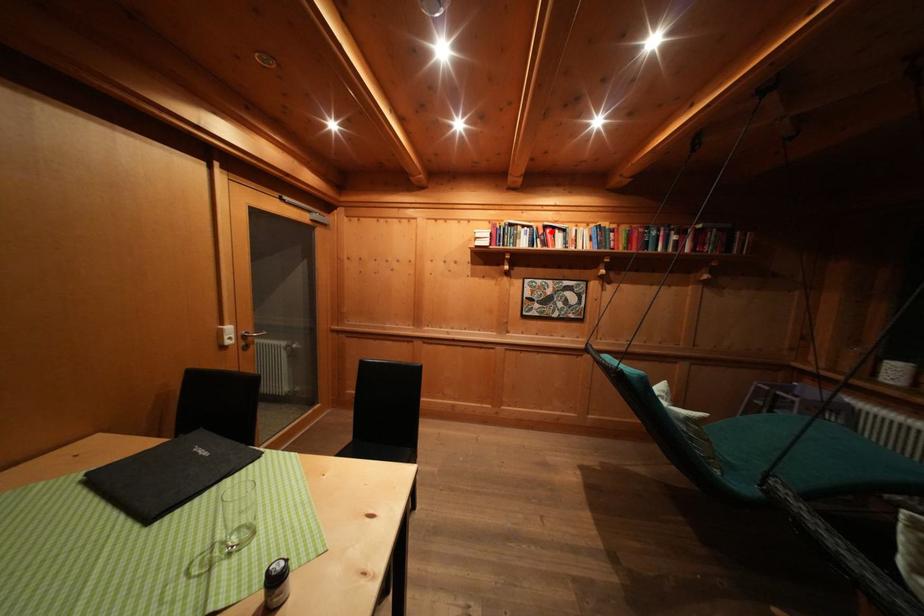
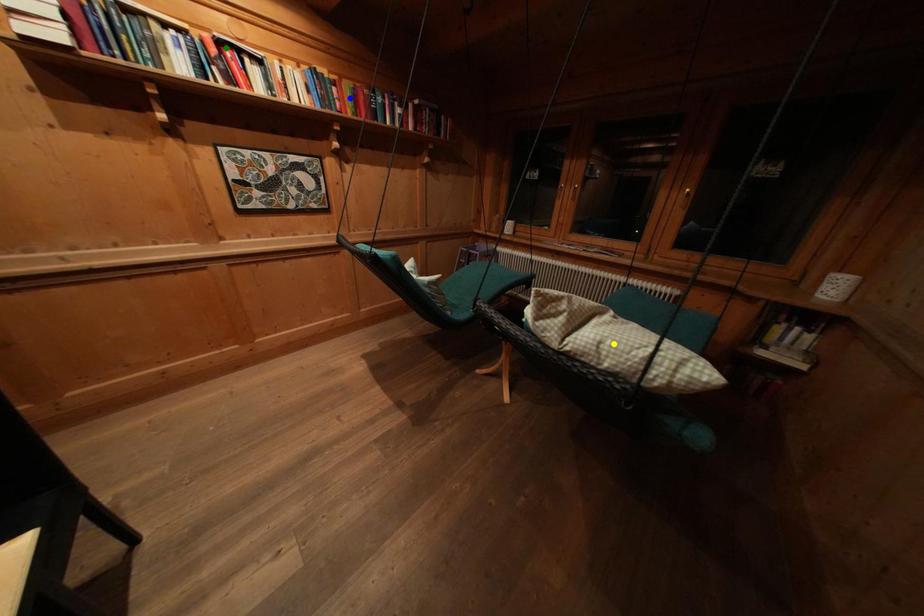
Question: I am providing you with two images of the same scene from different viewpoints. A red point is marked on the first image. You are given multiple points on the second image. Which mark in image 2 goes with the point in image 1?

Choices:
 (A) green point
 (B) blue point
 (C) yellow point

Answer: (A)